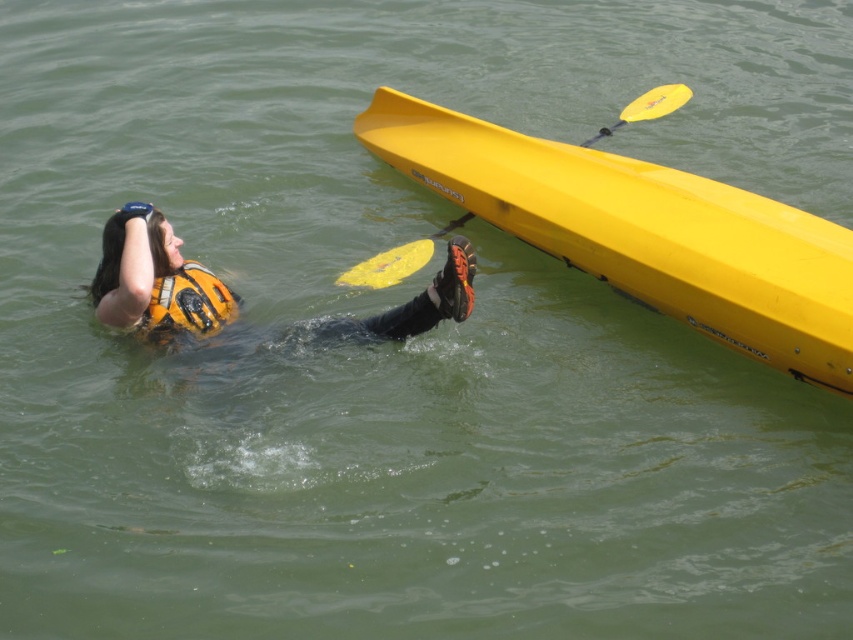
You are a lifeguard on duty and see the image. The distressed person is in the water. Where exactly is the orange matte life jacket at lower left located in the image?

The orange matte life jacket at lower left is located at the 2D coordinates point (187,305) in the image.

You are a lifeguard on duty and need to reach the orange matte life jacket at lower left before the yellow matte canoe at upper right. Which object can you reach first if you swim straight towards them?

The orange matte life jacket at lower left is closer than the yellow matte canoe at upper right, so you can reach it first.